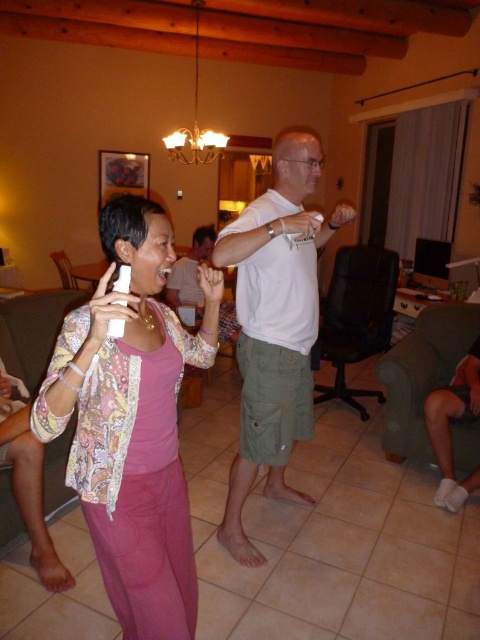
Which is above, matte pink pants at center or white cotton shirt at center?

white cotton shirt at center is higher up.

Can you confirm if matte pink pants at center is taller than white cotton shirt at center?

No.

Which is behind, point (178, 573) or point (245, 385)?

Positioned behind is point (245, 385).

What are the coordinates of `matte pink pants at center` in the screenshot? It's located at (132, 422).